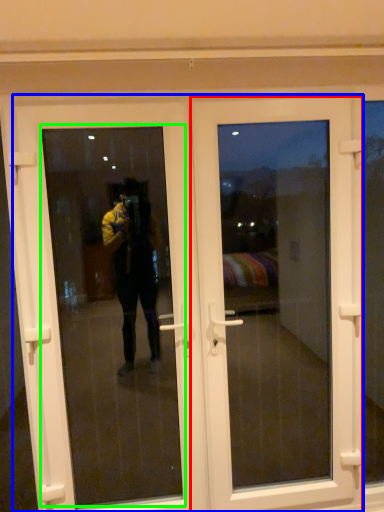
Question: Which object is positioned farthest from door (highlighted by a red box)? Select from door (highlighted by a blue box) and window screen (highlighted by a green box).

Choices:
 (A) door
 (B) window screen

Answer: (B)